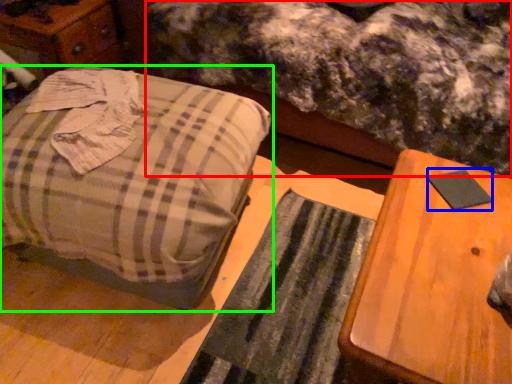
Question: Based on their relative distances, which object is nearer to mattress (highlighted by a red box)? Choose from pad (highlighted by a blue box) and furniture (highlighted by a green box).

Choices:
 (A) pad
 (B) furniture

Answer: (B)